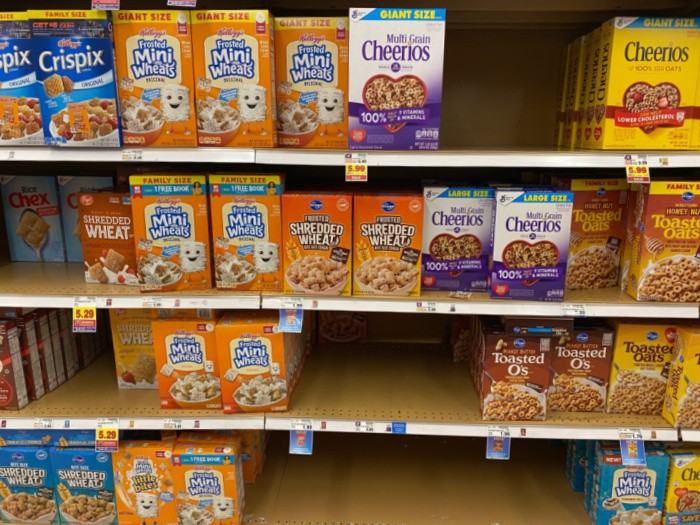
Where is `shelves`? The height and width of the screenshot is (525, 700). shelves is located at coordinates (384, 501), (402, 367), (584, 304), (502, 160).